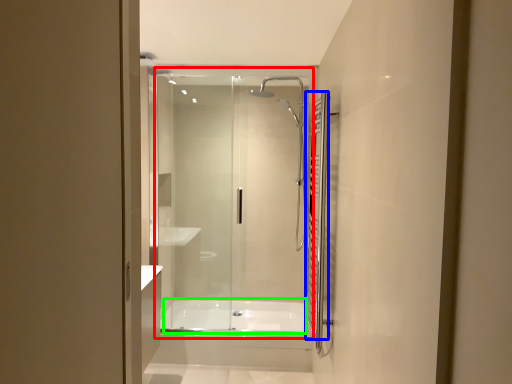
Question: Which object is the farthest from glass door (highlighted by a red box)? Choose among these: shower curtain (highlighted by a blue box) or bath (highlighted by a green box).

Choices:
 (A) shower curtain
 (B) bath

Answer: (A)